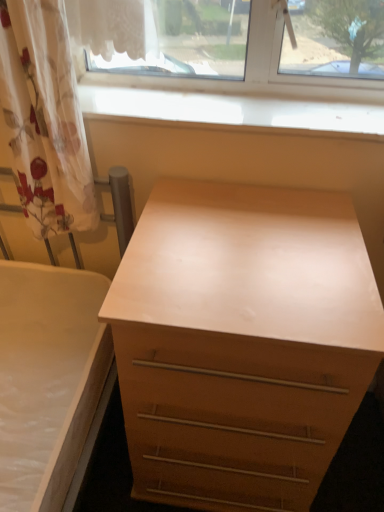
Question: Is translucent floral fabric at left at the left side of light wood chest of drawers at center?

Choices:
 (A) no
 (B) yes

Answer: (B)

Question: From the image's perspective, is translucent floral fabric at left on top of light wood chest of drawers at center?

Choices:
 (A) no
 (B) yes

Answer: (B)

Question: Can you see translucent floral fabric at left touching light wood chest of drawers at center?

Choices:
 (A) no
 (B) yes

Answer: (A)

Question: Considering the relative sizes of translucent floral fabric at left and light wood chest of drawers at center in the image provided, is translucent floral fabric at left smaller than light wood chest of drawers at center?

Choices:
 (A) no
 (B) yes

Answer: (B)

Question: From a real-world perspective, is translucent floral fabric at left over light wood chest of drawers at center?

Choices:
 (A) no
 (B) yes

Answer: (B)

Question: Is the position of translucent floral fabric at left more distant than that of light wood chest of drawers at center?

Choices:
 (A) yes
 (B) no

Answer: (A)

Question: Is translucent floral fabric at left touching smooth wood window sill at upper center?

Choices:
 (A) no
 (B) yes

Answer: (A)

Question: Can you confirm if translucent floral fabric at left is thinner than smooth wood window sill at upper center?

Choices:
 (A) yes
 (B) no

Answer: (A)

Question: From a real-world perspective, is translucent floral fabric at left on smooth wood window sill at upper center?

Choices:
 (A) yes
 (B) no

Answer: (A)

Question: Considering the relative positions of translucent floral fabric at left and smooth wood window sill at upper center in the image provided, is translucent floral fabric at left to the right of smooth wood window sill at upper center from the viewer's perspective?

Choices:
 (A) no
 (B) yes

Answer: (A)

Question: Is translucent floral fabric at left looking in the opposite direction of smooth wood window sill at upper center?

Choices:
 (A) yes
 (B) no

Answer: (A)

Question: Is translucent floral fabric at left completely or partially outside of smooth wood window sill at upper center?

Choices:
 (A) no
 (B) yes

Answer: (B)

Question: Is light wood chest of drawers at center with smooth wood window sill at upper center?

Choices:
 (A) no
 (B) yes

Answer: (A)